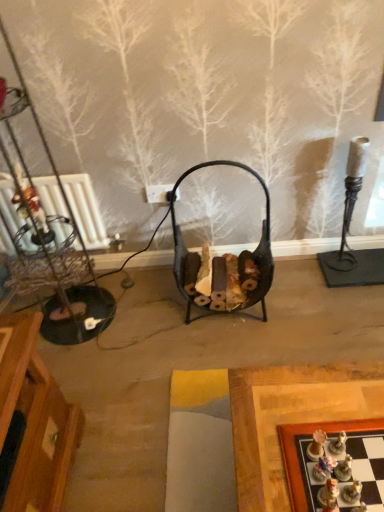
Question: From a real-world perspective, relative to black metal basket at center, is wooden chessboard at lower right vertically above or below?

Choices:
 (A) below
 (B) above

Answer: (B)

Question: Considering the positions of wooden chessboard at lower right and black metal basket at center in the image, is wooden chessboard at lower right wider or thinner than black metal basket at center?

Choices:
 (A) wide
 (B) thin

Answer: (A)

Question: Considering the real-world distances, which object is farthest from the wooden chessboard at lower right?

Choices:
 (A) black metal basket at center
 (B) matte plastic chess piece at lower right

Answer: (A)

Question: Which of these objects is positioned closest to the matte plastic chess piece at lower right?

Choices:
 (A) black metal basket at center
 (B) wooden chessboard at lower right

Answer: (B)